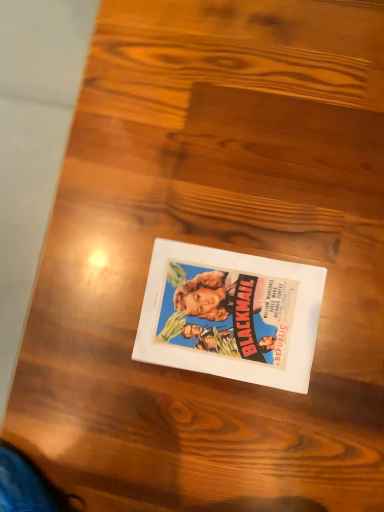
Locate an element on the screen. This screenshot has height=512, width=384. free space in front of matte paper book at center is located at coordinates [x=297, y=420].